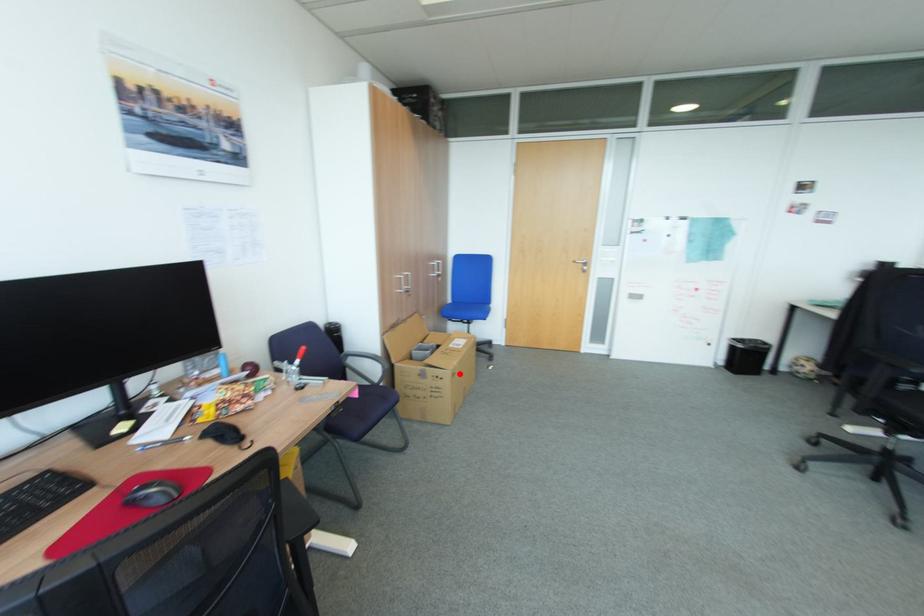
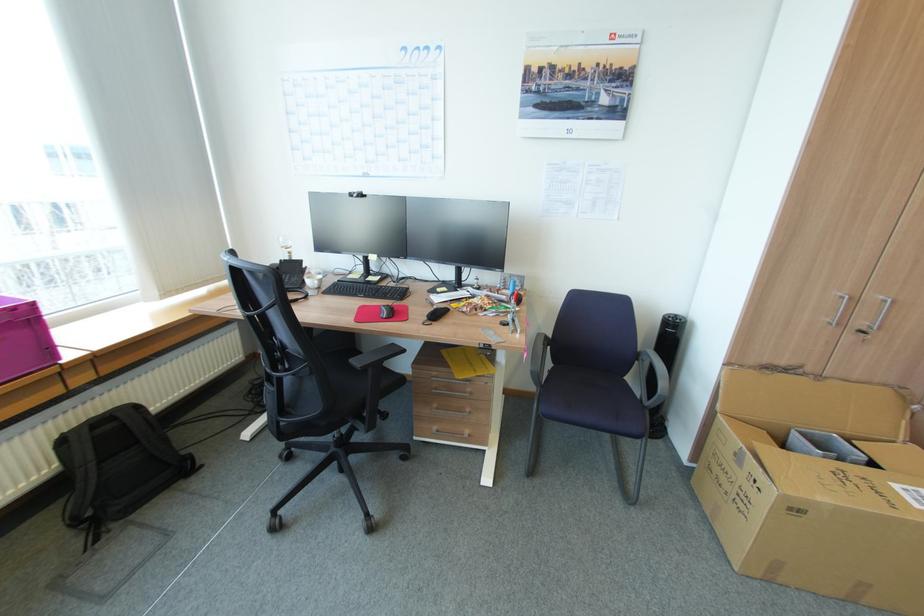
Find the pixel in the second image that matches the highlighted location in the first image.

(804, 511)